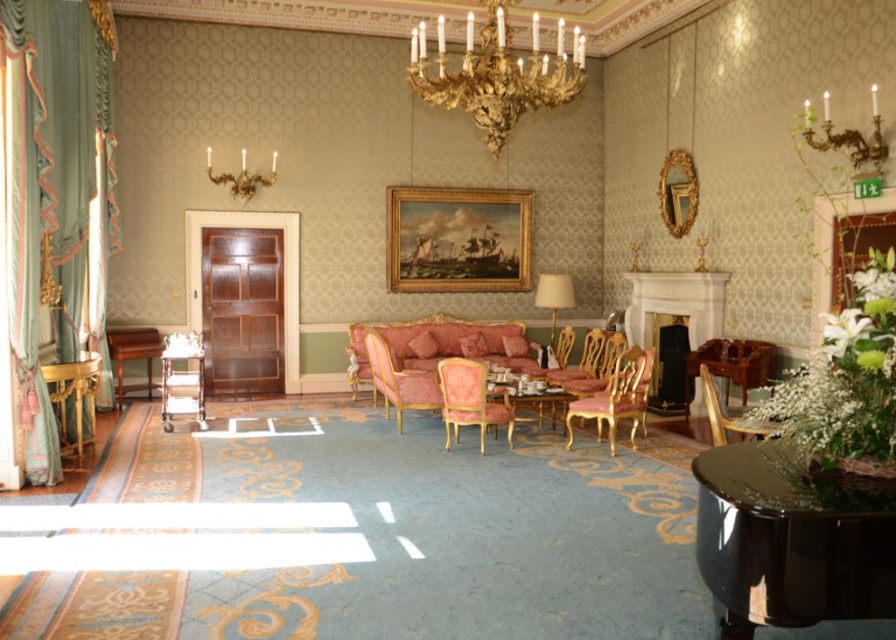
Is point (590, 397) less distant than point (540, 288)?

Yes.

Can you confirm if gold metallic armchair at center is positioned to the left of beige fabric lampshade at center?

No, gold metallic armchair at center is not to the left of beige fabric lampshade at center.

The height and width of the screenshot is (640, 896). Describe the element at coordinates (616, 397) in the screenshot. I see `gold metallic armchair at center` at that location.

The width and height of the screenshot is (896, 640). I want to click on gold metallic armchair at center, so click(616, 397).

Can you confirm if velvet pink armchair at center is positioned above wooden armchair at center?

Yes.

Based on the photo, which is more to the left, velvet pink armchair at center or wooden armchair at center?

Positioned to the left is velvet pink armchair at center.

Locate an element on the screen. This screenshot has height=640, width=896. velvet pink armchair at center is located at coordinates (399, 380).

Locate an element on the screen. velvet pink armchair at center is located at coordinates (399, 380).

Looking at this image, is gold metallic armchair at center bigger than wooden table at left?

Correct, gold metallic armchair at center is larger in size than wooden table at left.

Can you confirm if gold metallic armchair at center is positioned to the left of wooden table at left?

No, gold metallic armchair at center is not to the left of wooden table at left.

What do you see at coordinates (616, 397) in the screenshot? This screenshot has width=896, height=640. I see `gold metallic armchair at center` at bounding box center [616, 397].

Where is `gold metallic armchair at center`? Image resolution: width=896 pixels, height=640 pixels. gold metallic armchair at center is located at coordinates (616, 397).